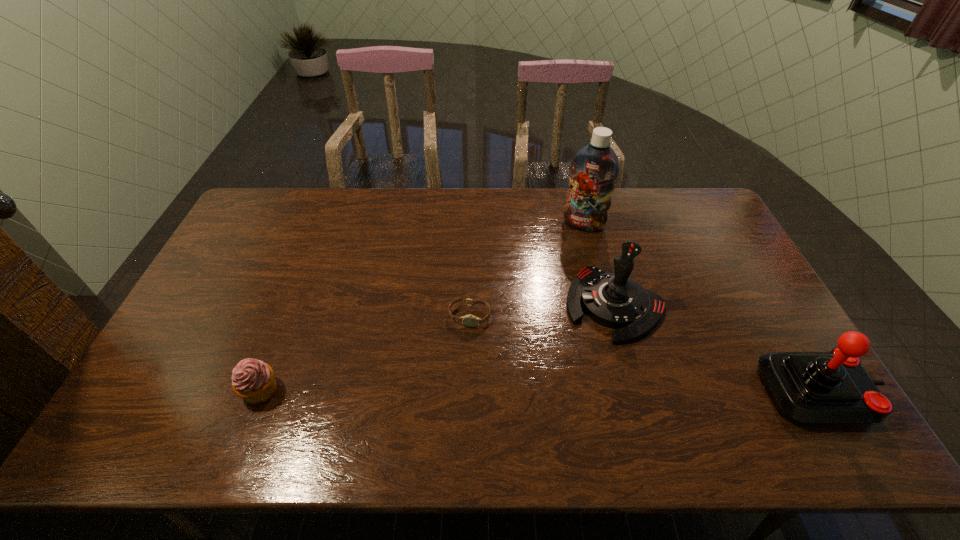
Image resolution: width=960 pixels, height=540 pixels. I want to click on vacant space on the desktop that is between the fourth tallest object and the nearer joystick and is positioned on the front label of the farthest object, so click(513, 390).

Locate an element on the screen. free spot on the desktop that is between the fourth tallest object and the rightmost object and is positioned on the handle side of the farther joystick is located at coordinates (560, 391).

At what (x,y) coordinates should I click in order to perform the action: click on free spot on the desktop that is between the fourth tallest object and the rightmost object and is positioned on the face of the second object from left to right. Please return your answer as a coordinate pair (x, y). This screenshot has width=960, height=540. Looking at the image, I should click on (457, 390).